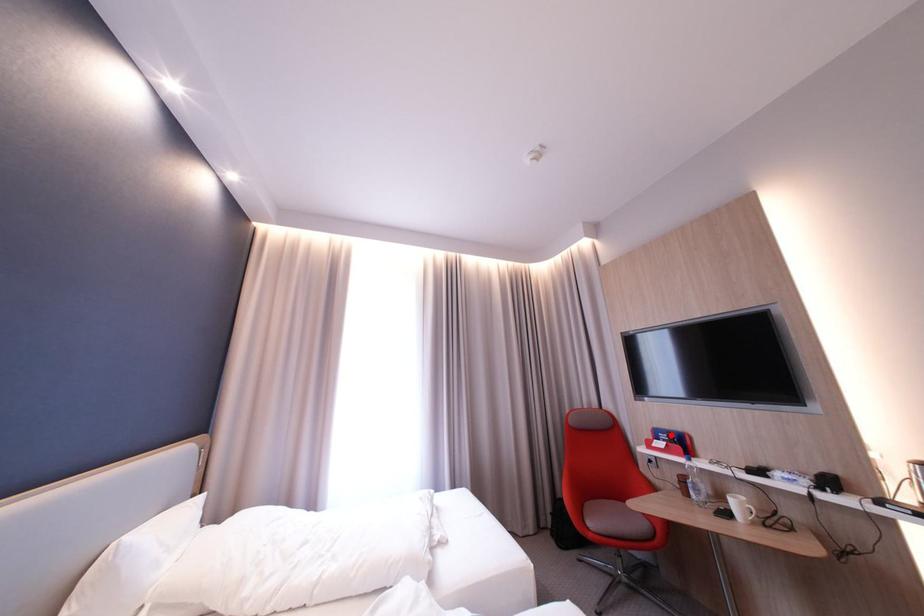
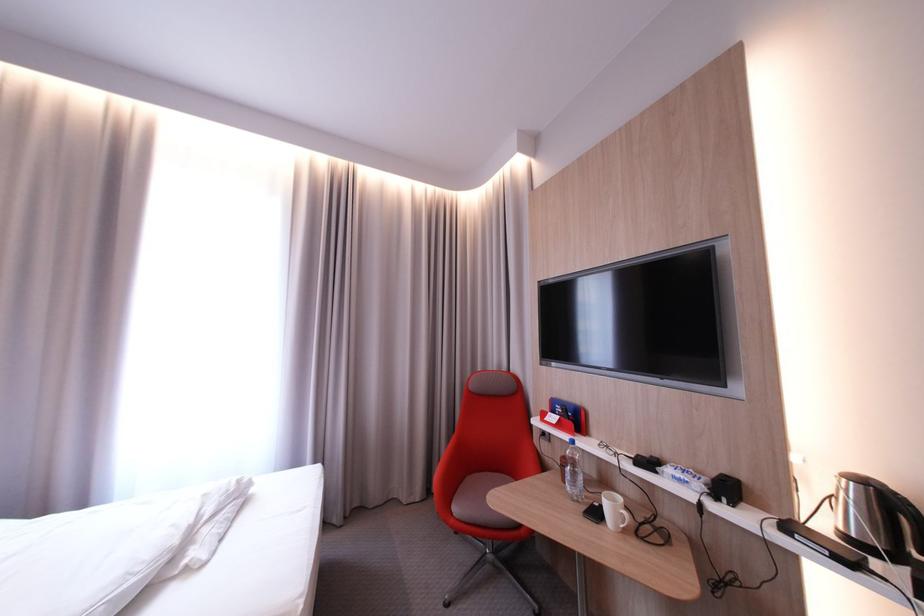
In the second image, find the point that corresponds to the highlighted location in the first image.

(568, 407)